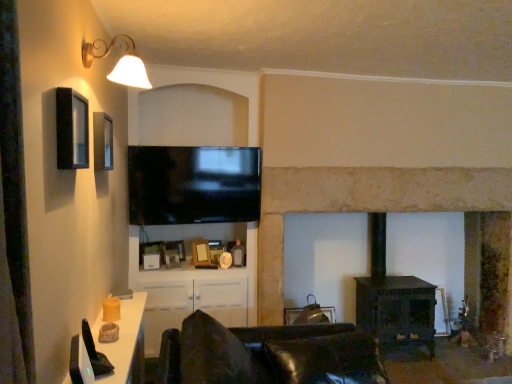
Identify the location of free spot above black glossy tv at center (from a real-world perspective). This screenshot has height=384, width=512. (195, 149).